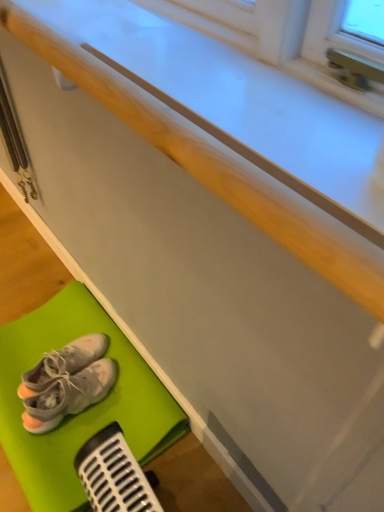
Question: Is white fabric sneakers at lower left, which appears as the second footwear when viewed from the top, spatially inside white fabric sneakers at lower left, placed as the 2th footwear when sorted from bottom to top, or outside of it?

Choices:
 (A) outside
 (B) inside

Answer: (A)

Question: In the image, is white fabric sneakers at lower left, which appears as the second footwear when viewed from the top, on the left side or the right side of white fabric sneakers at lower left, which appears as the 1th footwear when viewed from the top?

Choices:
 (A) left
 (B) right

Answer: (B)

Question: Which of these objects is positioned farthest from the white fabric sneakers at lower left, which appears as the 1th footwear when ordered from the bottom?

Choices:
 (A) matte white counter top at center
 (B) white fabric sneakers at lower left, which appears as the 1th footwear when viewed from the top
 (C) green rubber bath mat at lower left

Answer: (A)

Question: Which object is positioned closest to the green rubber bath mat at lower left?

Choices:
 (A) white fabric sneakers at lower left, which appears as the second footwear when viewed from the top
 (B) white fabric sneakers at lower left, placed as the 2th footwear when sorted from bottom to top
 (C) matte white counter top at center

Answer: (A)